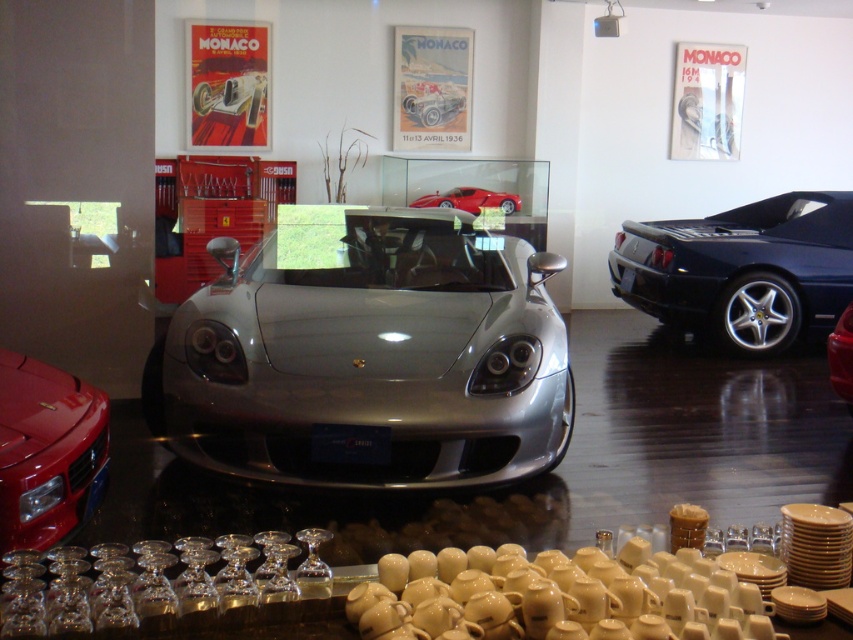
Question: Does silver metallic sports car at center come behind shiny black sports car at right?

Choices:
 (A) yes
 (B) no

Answer: (B)

Question: Which point is farther to the camera?

Choices:
 (A) shiny red sports car at center
 (B) shiny black car at right
 (C) shiny red ferrari at lower left
 (D) silver metallic sports car at center

Answer: (A)

Question: Which of the following is the closest to the observer?

Choices:
 (A) 410,205
 (B) 701,301
 (C) 534,298
 (D) 848,371

Answer: (C)

Question: Can you confirm if shiny black car at right is positioned to the right of shiny red sports car at center?

Choices:
 (A) yes
 (B) no

Answer: (A)

Question: Can you confirm if silver metallic sports car at center is positioned above shiny red ferrari at lower left?

Choices:
 (A) yes
 (B) no

Answer: (A)

Question: Which point is closer to the camera?

Choices:
 (A) (44, 412)
 (B) (463, 192)
 (C) (694, 273)
 (D) (846, 360)

Answer: (A)